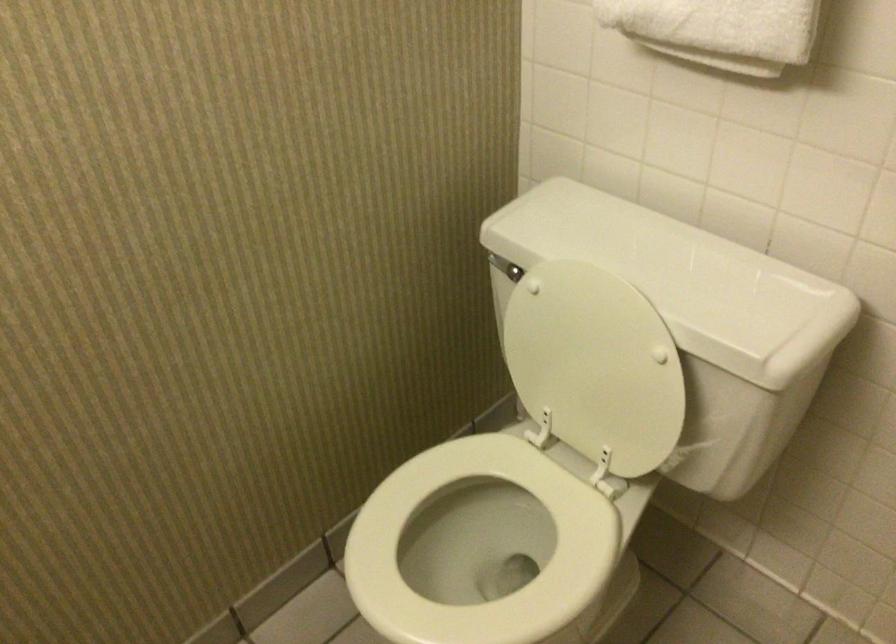
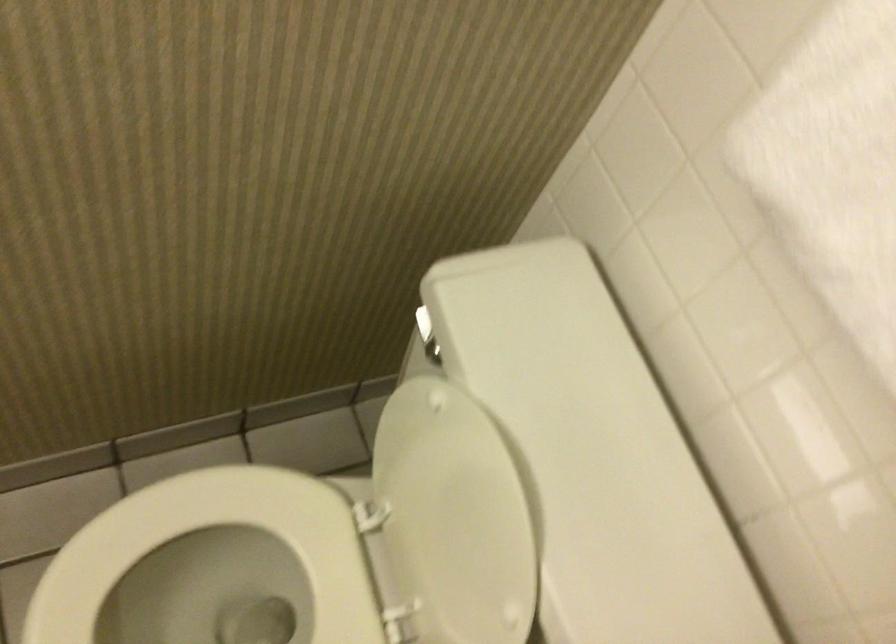
The point at (467, 571) is marked in the first image. Where is the corresponding point in the second image?

(222, 590)